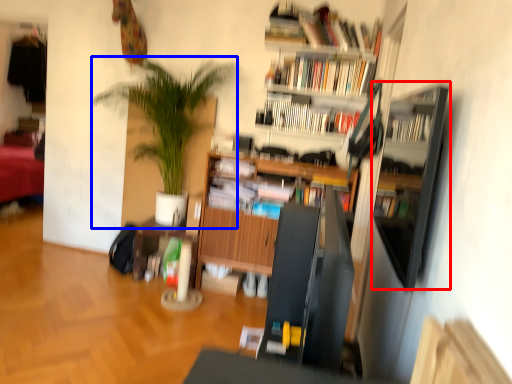
Question: Which object appears closest to the camera in this image, shelf (highlighted by a red box) or houseplant (highlighted by a blue box)?

Choices:
 (A) shelf
 (B) houseplant

Answer: (A)